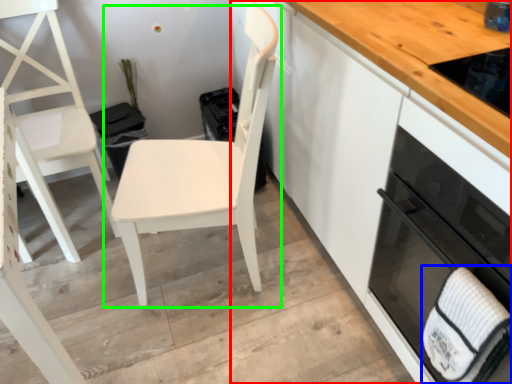
Question: Based on their relative distances, which object is farther from cabinetry (highlighted by a red box)? Choose from hand towel (highlighted by a blue box) and chair (highlighted by a green box).

Choices:
 (A) hand towel
 (B) chair

Answer: (A)